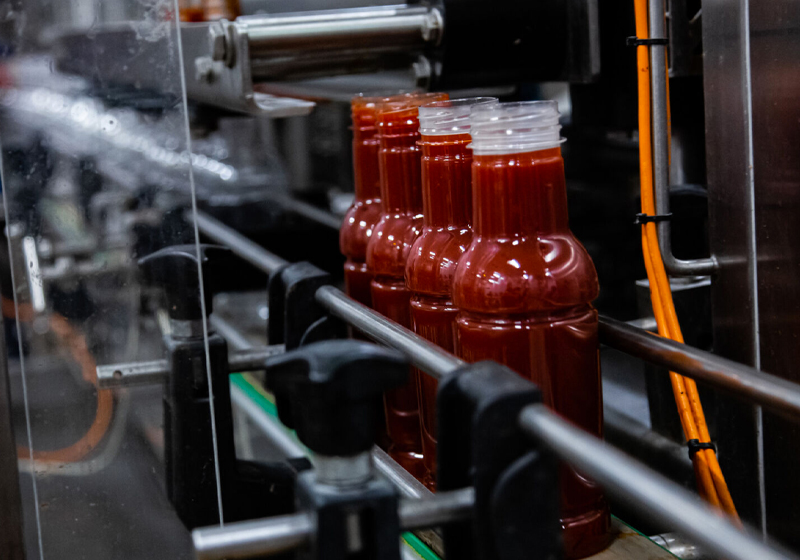
Locate an element on the screen. This screenshot has height=560, width=800. bar is located at coordinates (361, 312).